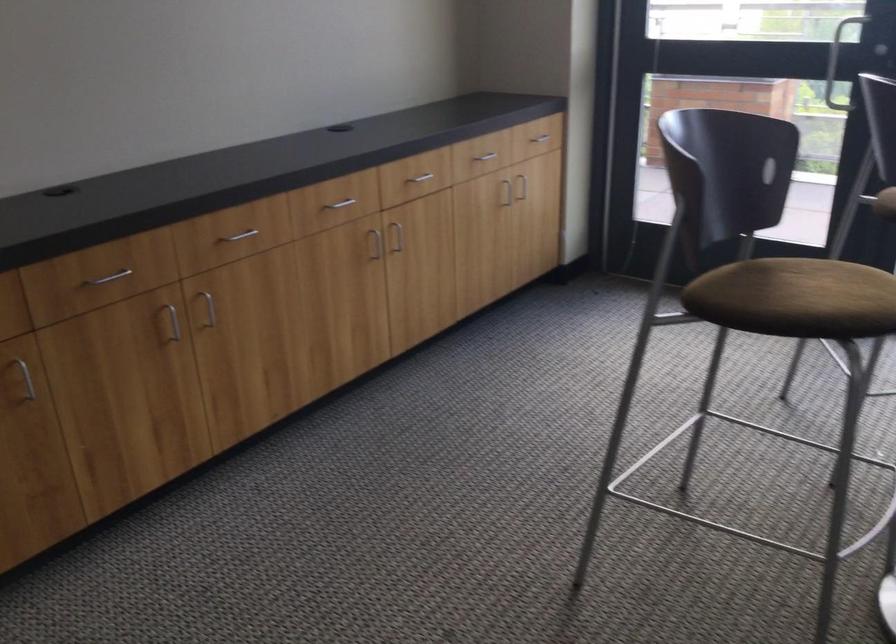
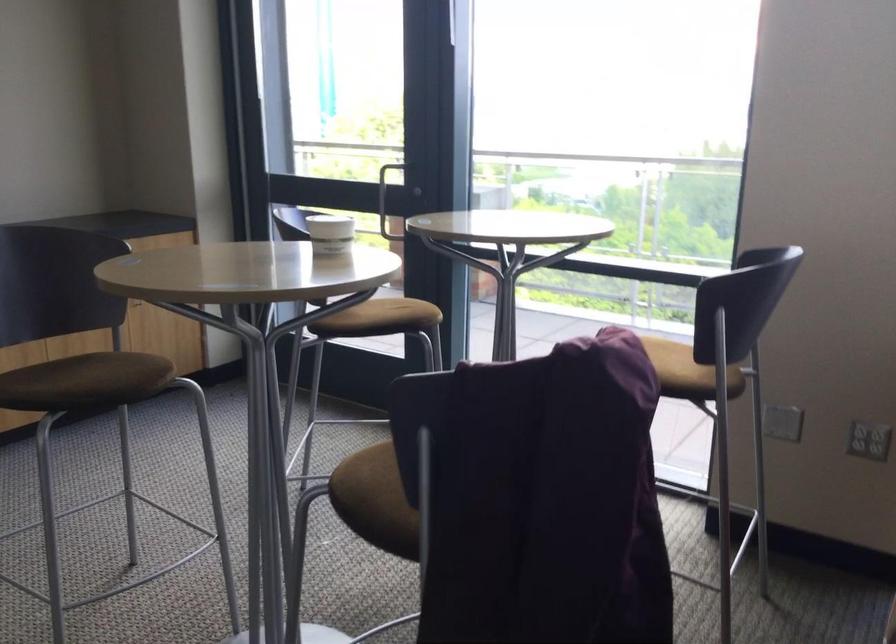
Question: What movement of the cameraman would produce the second image?

Choices:
 (A) Left
 (B) Right
 (C) Forward
 (D) Backward

Answer: (B)